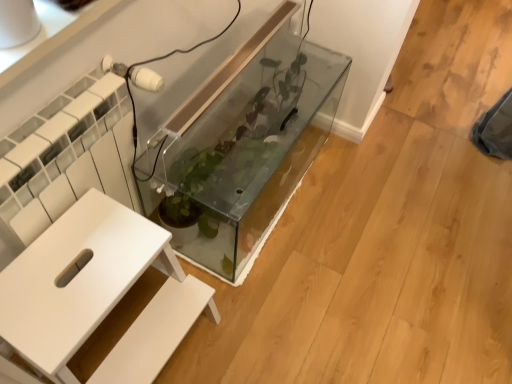
Locate an element on the screen. The image size is (512, 384). vacant area to the right of white matte table at center is located at coordinates (258, 328).